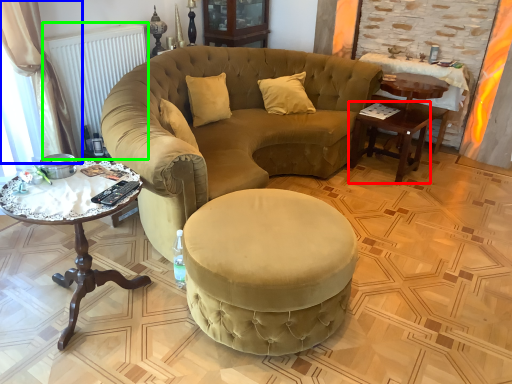
Question: Based on their relative distances, which object is farther from table (highlighted by a red box)? Choose from curtain (highlighted by a blue box) and radiator (highlighted by a green box).

Choices:
 (A) curtain
 (B) radiator

Answer: (A)